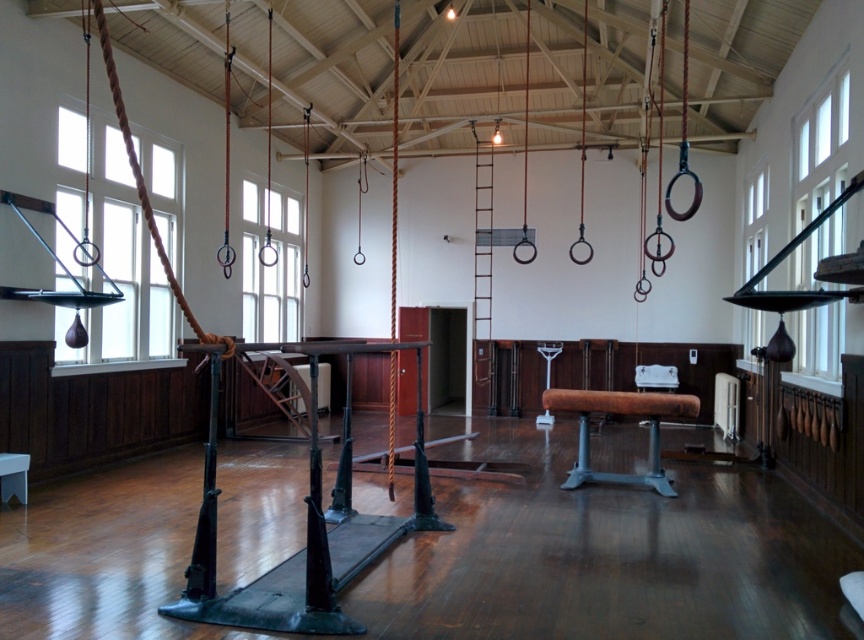
In the scene shown: Does brown leather beam at center appear over metallic stool at lower left?

Indeed, brown leather beam at center is positioned over metallic stool at lower left.

Is brown leather beam at center thinner than metallic stool at lower left?

No, brown leather beam at center is not thinner than metallic stool at lower left.

The height and width of the screenshot is (640, 864). Find the location of `brown leather beam at center`. brown leather beam at center is located at coordinates (621, 403).